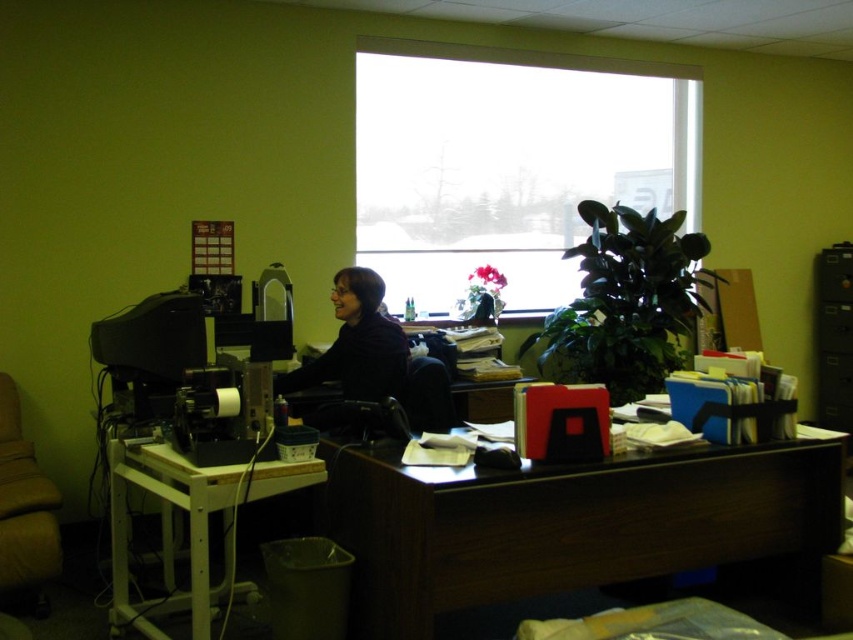
Question: Which of the following is the closest to the observer?

Choices:
 (A) brown fabric swivel chair at left
 (B) dark wood desk at center
 (C) matte black shirt at center

Answer: (B)

Question: Does transparent glass window at upper center appear over brown fabric swivel chair at left?

Choices:
 (A) yes
 (B) no

Answer: (A)

Question: Among these points, which one is nearest to the camera?

Choices:
 (A) (358, 464)
 (B) (12, 528)
 (C) (396, 378)

Answer: (A)

Question: Is matte black shirt at center positioned before brown fabric swivel chair at left?

Choices:
 (A) yes
 (B) no

Answer: (A)

Question: Which of the following is the closest to the observer?

Choices:
 (A) (392, 528)
 (B) (51, 500)

Answer: (A)

Question: Does dark wood desk at center have a smaller size compared to white plastic table at lower left?

Choices:
 (A) yes
 (B) no

Answer: (B)